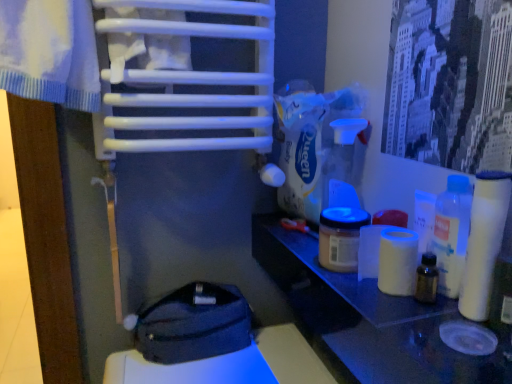
Question: Does point (286, 288) appear closer or farther from the camera than point (442, 276)?

Choices:
 (A) farther
 (B) closer

Answer: (A)

Question: Considering the positions of white glossy table at right and translucent plastic bottle at right in the image, is white glossy table at right wider or thinner than translucent plastic bottle at right?

Choices:
 (A) wide
 (B) thin

Answer: (A)

Question: Based on their relative distances, which object is farther from the white glossy table at right?

Choices:
 (A) white matte toilet paper at right, the first toilet paper viewed from the back
 (B) dark gray fabric pouch at lower center
 (C) translucent plastic bottle at right
 (D) matte plastic jar at center
 (E) white matte toilet paper at right, marked as the first toilet paper in a front-to-back arrangement

Answer: (B)

Question: Which object is the closest to the white glossy table at right?

Choices:
 (A) translucent plastic bottle at right
 (B) white matte toilet paper at right, which ranks as the 2th toilet paper in right-to-left order
 (C) matte plastic jar at center
 (D) dark gray fabric pouch at lower center
 (E) white matte toilet paper at right, marked as the first toilet paper in a front-to-back arrangement

Answer: (C)